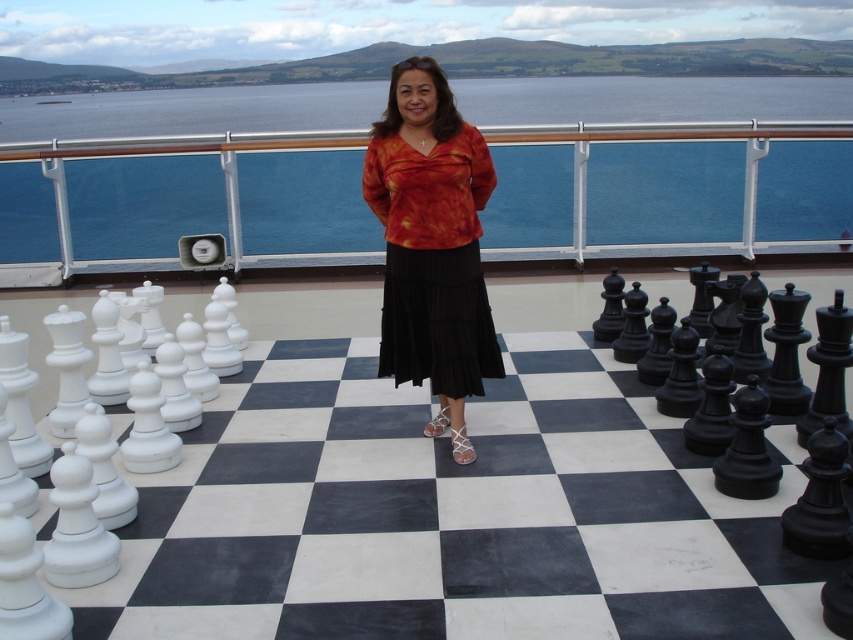
Question: Can you confirm if white glossy chessboard at center is positioned to the right of orange tie-dye blouse at center?

Choices:
 (A) yes
 (B) no

Answer: (B)

Question: Can you confirm if blue water at upper center is positioned to the left of orange tie-dye blouse at center?

Choices:
 (A) no
 (B) yes

Answer: (A)

Question: Which object appears farthest from the camera in this image?

Choices:
 (A) orange tie-dye blouse at center
 (B) white glossy chessboard at center
 (C) blue water at upper center

Answer: (C)

Question: Among these points, which one is farthest from the camera?

Choices:
 (A) (846, 77)
 (B) (485, 316)
 (C) (628, 458)

Answer: (A)

Question: Which point appears closest to the camera in this image?

Choices:
 (A) tap(126, 96)
 (B) tap(471, 148)
 (C) tap(810, 570)

Answer: (C)

Question: Does white glossy chessboard at center appear on the right side of orange tie-dye blouse at center?

Choices:
 (A) yes
 (B) no

Answer: (B)